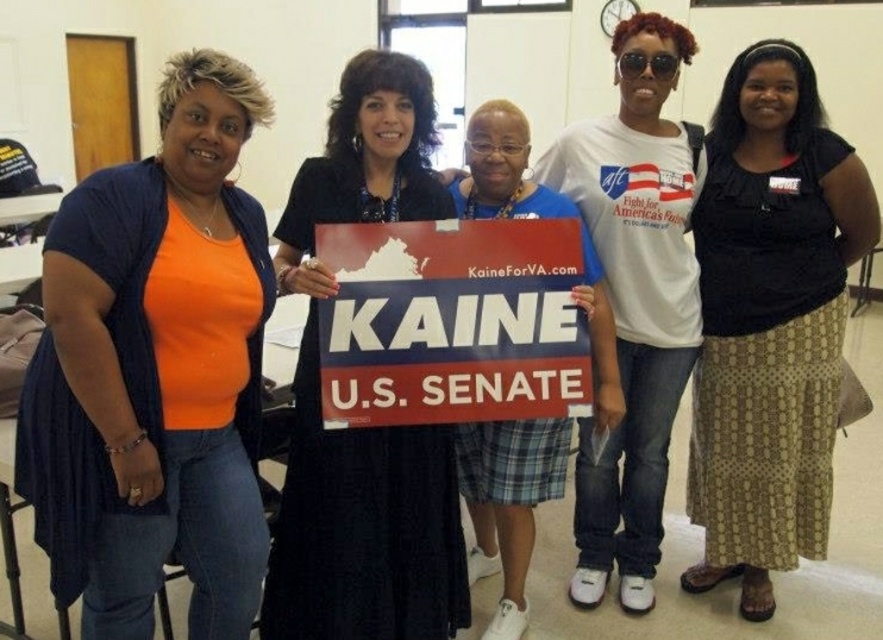
Consider the image. You are a photographer at a political event. You need to adjust the lighting so that the matte plastic sign at center is evenly lit. However, you must ensure that the black textured skirt at center does not cast a shadow on the sign. Given their distance, is this possible?

The black textured skirt at center is 33.22 inches from matte plastic sign at center. Since the skirt is relatively far from the sign, it is possible to adjust the lighting so that the sign is evenly lit without the skirt casting a shadow.